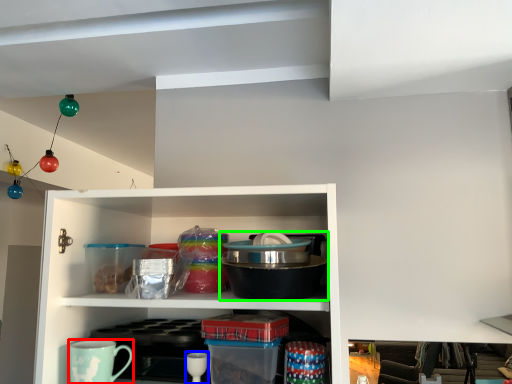
Question: Estimate the real-world distances between objects in this image. Which object is closer to coffee cup (highlighted by a red box), tableware (highlighted by a blue box) or appliance (highlighted by a green box)?

Choices:
 (A) tableware
 (B) appliance

Answer: (A)